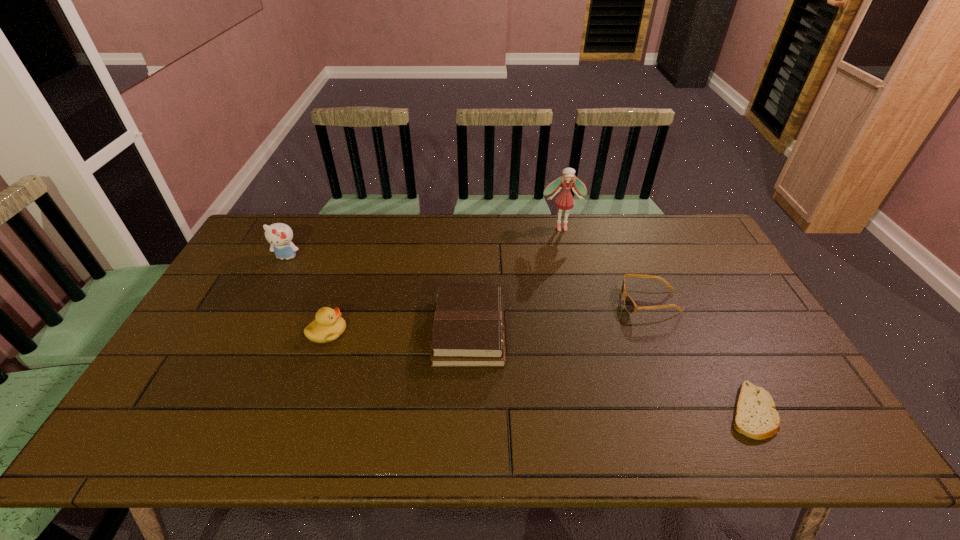
Point out which object is positioned as the fifth nearest to the kitten. Please provide its 2D coordinates. Your answer should be formatted as a tuple, i.e. [(x, y)], where the tuple contains the x and y coordinates of a point satisfying the conditions above.

[(755, 416)]

Locate an element on the screen. The height and width of the screenshot is (540, 960). object identified as the fourth closest to the sunglasses is located at coordinates (328, 325).

Locate an element on the screen. vacant region that satisfies the following two spatial constraints: 1. on the front-facing side of the second tallest object; 2. on the left side of the shortest object is located at coordinates (207, 411).

Locate an element on the screen. Image resolution: width=960 pixels, height=540 pixels. vacant region that satisfies the following two spatial constraints: 1. on the front-facing side of the doll; 2. on the spine side of the third object from left to right is located at coordinates (586, 332).

You are a GUI agent. You are given a task and a screenshot of the screen. Output one action in this format:
    pyautogui.click(x=<x>, y=<y>)
    Task: Click on the vacant region that satisfies the following two spatial constraints: 1. on the front-facing side of the tallest object; 2. on the front-facing side of the duckling
    The height and width of the screenshot is (540, 960).
    Given the screenshot: What is the action you would take?
    pyautogui.click(x=586, y=332)

Where is `free location that satisfies the following two spatial constraints: 1. on the spine side of the pita bread; 2. on the left side of the Bible`? free location that satisfies the following two spatial constraints: 1. on the spine side of the pita bread; 2. on the left side of the Bible is located at coordinates [x=468, y=411].

The width and height of the screenshot is (960, 540). I want to click on vacant space that satisfies the following two spatial constraints: 1. on the front-facing side of the fourth object from left to right; 2. on the front-facing side of the duckling, so click(x=586, y=332).